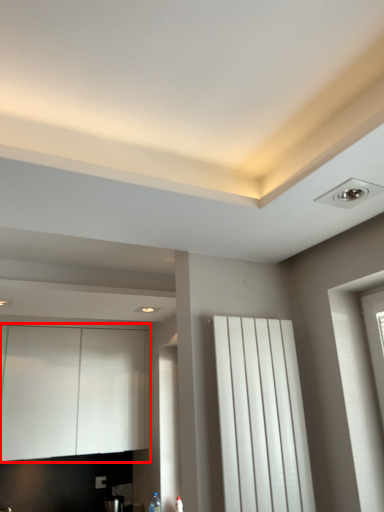
Question: From the image's perspective, what is the correct spatial relationship of cabinetry (annotated by the red box) in relation to curtain?

Choices:
 (A) above
 (B) below

Answer: (B)